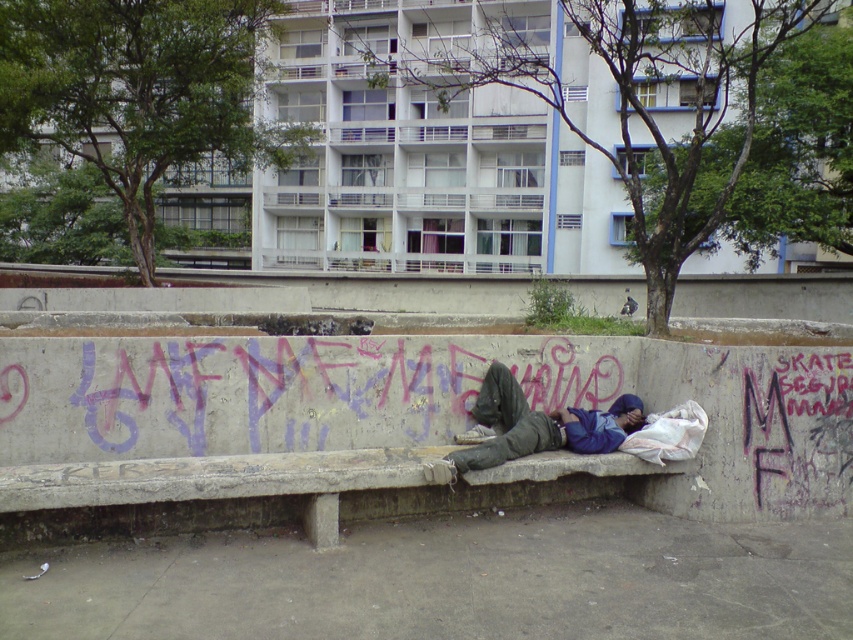
You are a photographer trying to capture a closeup of the graffiti on the bench. You notice two points on the bench marked as point 1 at coordinates point (338,474) and point 2 at coordinates point (498,397). Which point should you focus on to ensure the graffiti is in sharp focus without moving the camera?

You should focus on point (338,474) because it is closer to the camera than point (498,397), so it will be in sharper focus without moving the camera.

You are a delivery person carrying a package that is 24 inches long. You need to place it on the concrete bench at center without overlapping the blue fleece jacket at center. Is there enough space?

The distance between the concrete bench at center and blue fleece jacket at center is 24.18 inches. Since the package is 24 inches long, there is enough space to place it without overlapping.